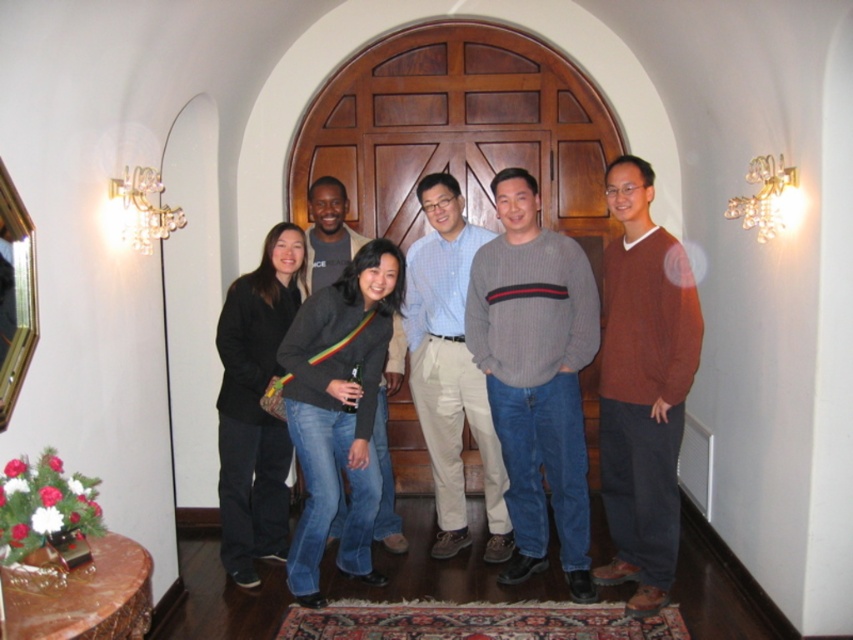
Between matte brown sweater at right and gray sweater at center, which one appears on the right side from the viewer's perspective?

matte brown sweater at right

Find the location of `matte brown sweater at right`. matte brown sweater at right is located at coordinates (643, 387).

Who is more forward, (643, 324) or (496, 552)?

Positioned in front is point (643, 324).

You are a GUI agent. You are given a task and a screenshot of the screen. Output one action in this format:
    pyautogui.click(x=<x>, y=<y>)
    Task: Click on the matte brown sweater at right
    
    Given the screenshot: What is the action you would take?
    pyautogui.click(x=643, y=387)

Who is positioned more to the right, matte brown sweater at right or dark gray sweater at center?

Positioned to the right is matte brown sweater at right.

Can you confirm if matte brown sweater at right is bigger than dark gray sweater at center?

Indeed, matte brown sweater at right has a larger size compared to dark gray sweater at center.

Is point (607, 250) in front of point (357, 248)?

Yes, point (607, 250) is closer to viewer.

At what (x,y) coordinates should I click in order to perform the action: click on matte brown sweater at right. Please return your answer as a coordinate pair (x, y). This screenshot has width=853, height=640. Looking at the image, I should click on (643, 387).

Who is taller, gray sweater at center or dark gray sweater at center?

With more height is gray sweater at center.

Does point (412, 310) come in front of point (337, 524)?

No, (412, 310) is behind (337, 524).

Is point (456, 332) positioned behind point (316, 224)?

No, it is in front of (316, 224).

You are a GUI agent. You are given a task and a screenshot of the screen. Output one action in this format:
    pyautogui.click(x=<x>, y=<y>)
    Task: Click on the gray sweater at center
    
    Given the screenshot: What is the action you would take?
    pyautogui.click(x=450, y=369)